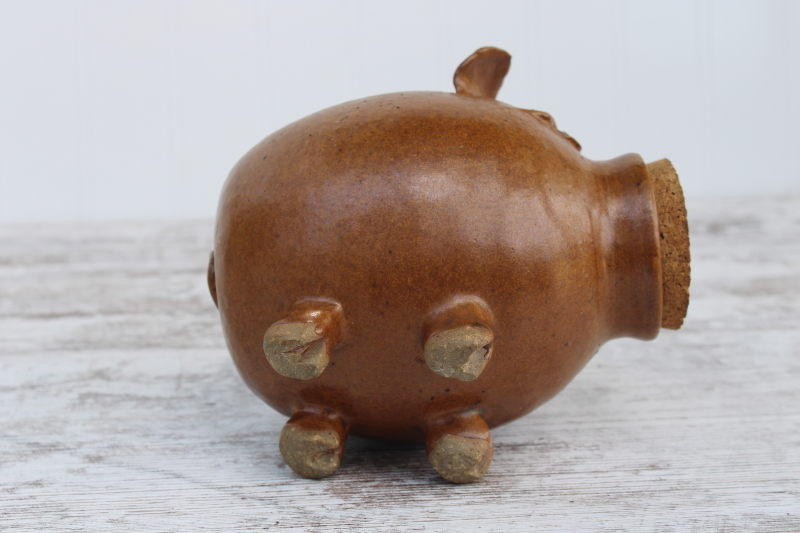
You are a GUI agent. You are given a task and a screenshot of the screen. Output one action in this format:
    pyautogui.click(x=<x>, y=<y>)
    Task: Click on the right front leg
    The image size is (800, 533).
    Given the screenshot: What is the action you would take?
    pyautogui.click(x=476, y=349)